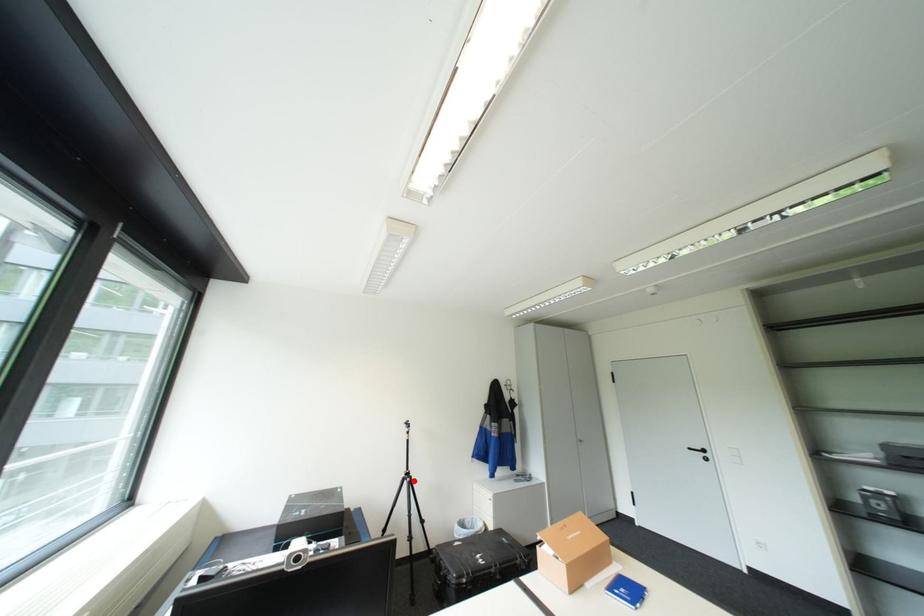
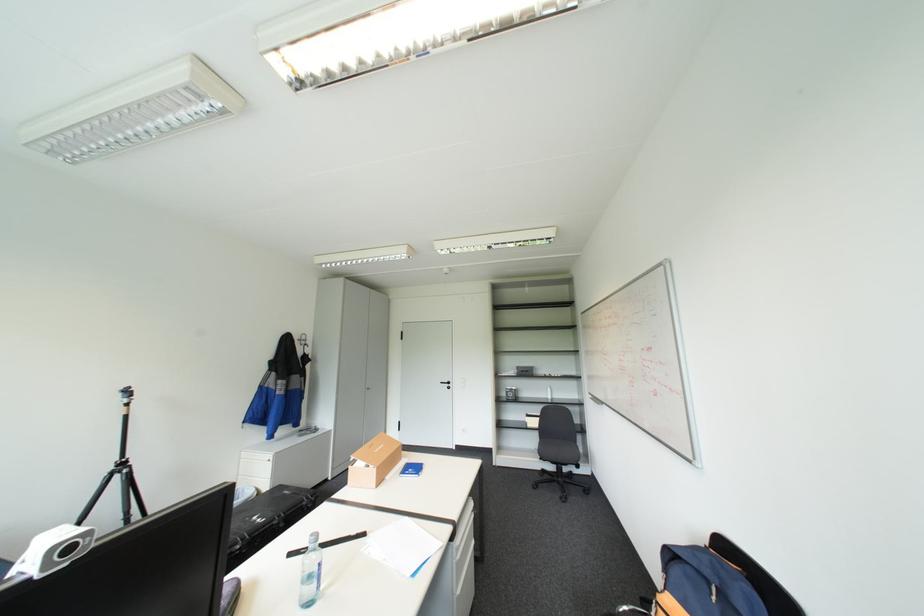
Where in the second image is the point corresponding to the highlighted location from the first image?

(126, 475)